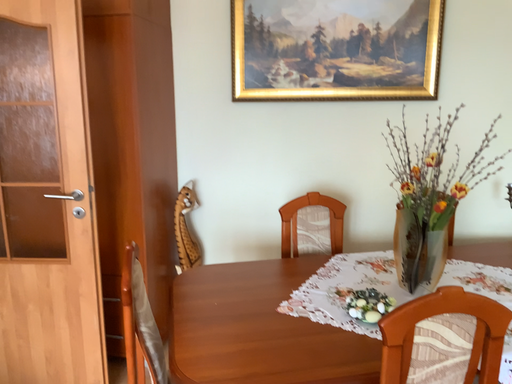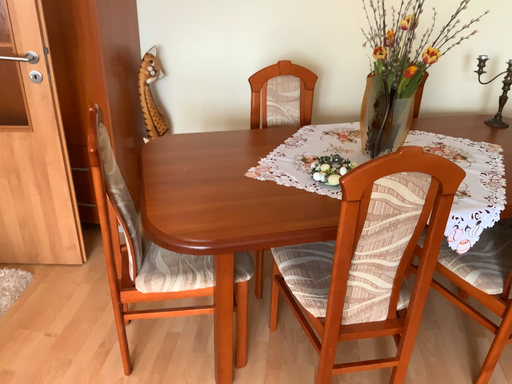
Question: How did the camera likely rotate when shooting the video?

Choices:
 (A) rotated upward
 (B) rotated downward

Answer: (B)